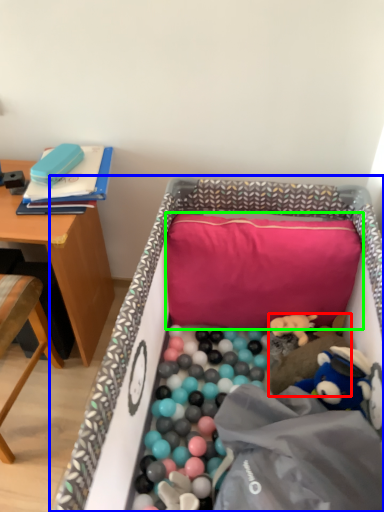
Question: Which object is positioned closest to toy (highlighted by a red box)? Select from infant bed (highlighted by a blue box) and pillow (highlighted by a green box).

Choices:
 (A) infant bed
 (B) pillow

Answer: (B)